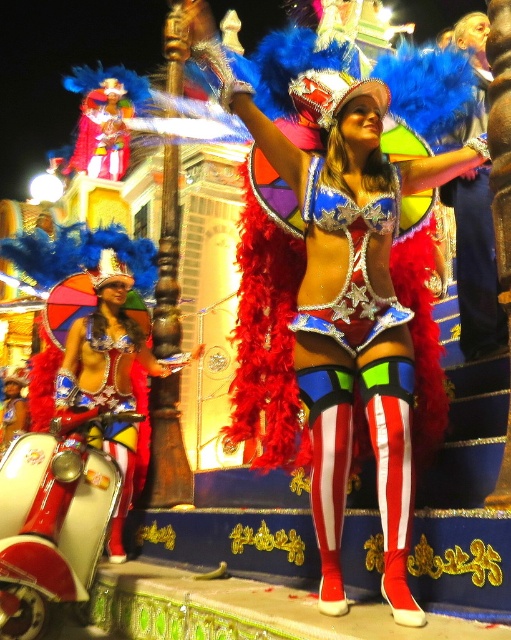
Question: Is shiny metallic costume at center below shiny metallic scooter at lower left?

Choices:
 (A) no
 (B) yes

Answer: (A)

Question: Which point is closer to the camera?

Choices:
 (A) (117, 513)
 (B) (91, 451)

Answer: (B)

Question: Can you confirm if white glossy scooter at lower left is smaller than shiny metallic scooter at lower left?

Choices:
 (A) no
 (B) yes

Answer: (B)

Question: Which point is farther from the camera taking this photo?

Choices:
 (A) (96, 380)
 (B) (408, 316)

Answer: (A)

Question: Which point appears farthest from the camera in this image?

Choices:
 (A) (66, 436)
 (B) (356, 436)
 (C) (123, 561)

Answer: (C)

Question: Is shiny metallic costume at center to the left of white glossy scooter at lower left from the viewer's perspective?

Choices:
 (A) yes
 (B) no

Answer: (B)